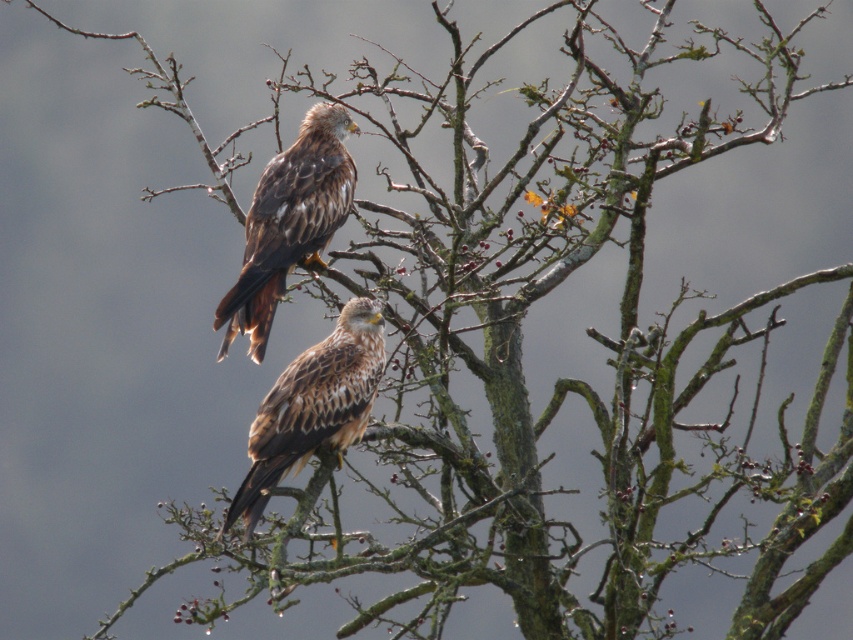
Which is behind, point (252, 218) or point (263, 435)?

Point (252, 218)

Who is more forward, (x=325, y=156) or (x=350, y=442)?

Point (x=350, y=442) is more forward.

Which is in front, point (252, 332) or point (254, 438)?

Point (254, 438) is in front.

This screenshot has height=640, width=853. I want to click on brown speckled feathers at upper center, so click(289, 221).